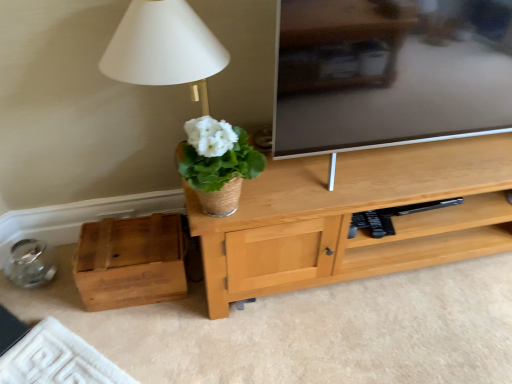
Question: Is white woven pot at center thinner than wooden box at lower left?

Choices:
 (A) yes
 (B) no

Answer: (A)

Question: From a real-world perspective, is white woven pot at center under wooden box at lower left?

Choices:
 (A) no
 (B) yes

Answer: (A)

Question: Does white woven pot at center have a greater width compared to wooden box at lower left?

Choices:
 (A) yes
 (B) no

Answer: (B)

Question: Is white woven pot at center bigger than wooden box at lower left?

Choices:
 (A) yes
 (B) no

Answer: (B)

Question: Does white woven pot at center have a greater height compared to wooden box at lower left?

Choices:
 (A) yes
 (B) no

Answer: (A)

Question: Is white woven pot at center positioned beyond the bounds of wooden box at lower left?

Choices:
 (A) no
 (B) yes

Answer: (B)

Question: Does wooden box at lower left appear on the right side of white woven pot at center?

Choices:
 (A) no
 (B) yes

Answer: (A)

Question: From a real-world perspective, is wooden box at lower left on white woven pot at center?

Choices:
 (A) no
 (B) yes

Answer: (A)

Question: Is there a large distance between wooden box at lower left and white woven pot at center?

Choices:
 (A) yes
 (B) no

Answer: (B)

Question: Is white woven pot at center at the back of wooden box at lower left?

Choices:
 (A) yes
 (B) no

Answer: (B)

Question: From the image's perspective, does wooden box at lower left appear higher than white woven pot at center?

Choices:
 (A) no
 (B) yes

Answer: (A)

Question: Is wooden box at lower left in front of white woven pot at center?

Choices:
 (A) no
 (B) yes

Answer: (A)

Question: Is point (202, 130) positioned closer to the camera than point (172, 223)?

Choices:
 (A) farther
 (B) closer

Answer: (B)